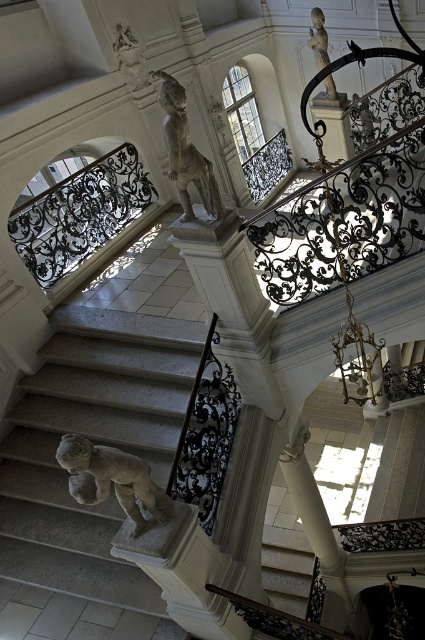
In the scene shown: Is matte white statue at upper center thinner than white marble statue at upper center?

Incorrect, matte white statue at upper center's width is not less than white marble statue at upper center's.

Can you confirm if matte white statue at upper center is positioned to the right of white marble statue at upper center?

Incorrect, matte white statue at upper center is not on the right side of white marble statue at upper center.

Who is more distant from viewer, (215, 208) or (312, 38)?

The point (312, 38) is behind.

At what (x,y) coordinates should I click in order to perform the action: click on matte white statue at upper center. Please return your answer as a coordinate pair (x, y). This screenshot has width=425, height=640. Looking at the image, I should click on pos(186,150).

Is point (166, 474) in front of point (108, 454)?

No, (166, 474) is behind (108, 454).

Does white marble statue at center have a lesser width compared to white stone statue at center?

Incorrect, white marble statue at center's width is not less than white stone statue at center's.

Which is behind, point (102, 416) or point (65, 449)?

Point (102, 416)

Locate an element on the screen. This screenshot has height=640, width=425. white marble statue at center is located at coordinates (95, 442).

Who is more distant from viewer, (30, 596) or (323, 65)?

The point (323, 65) is more distant.

Who is positioned more to the left, white marble statue at center or white marble statue at upper center?

From the viewer's perspective, white marble statue at center appears more on the left side.

Locate an element on the screen. The height and width of the screenshot is (640, 425). white marble statue at center is located at coordinates (95, 442).